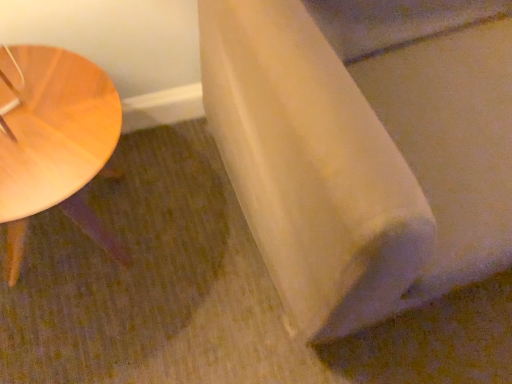
Question: Would you say light wood table at left is to the left or to the right of white matte fabric at lower right in the picture?

Choices:
 (A) right
 (B) left

Answer: (B)

Question: Is light wood table at left taller or shorter than white matte fabric at lower right?

Choices:
 (A) tall
 (B) short

Answer: (B)

Question: From a real-world perspective, relative to white matte fabric at lower right, is light wood table at left vertically above or below?

Choices:
 (A) above
 (B) below

Answer: (B)

Question: Would you say white matte fabric at lower right is to the left or to the right of light wood table at left in the picture?

Choices:
 (A) right
 (B) left

Answer: (A)

Question: Is point (290, 23) positioned closer to the camera than point (1, 72)?

Choices:
 (A) closer
 (B) farther

Answer: (A)

Question: In terms of height, does white matte fabric at lower right look taller or shorter compared to light wood table at left?

Choices:
 (A) short
 (B) tall

Answer: (B)

Question: Is white matte fabric at lower right inside the boundaries of light wood table at left, or outside?

Choices:
 (A) outside
 (B) inside

Answer: (A)